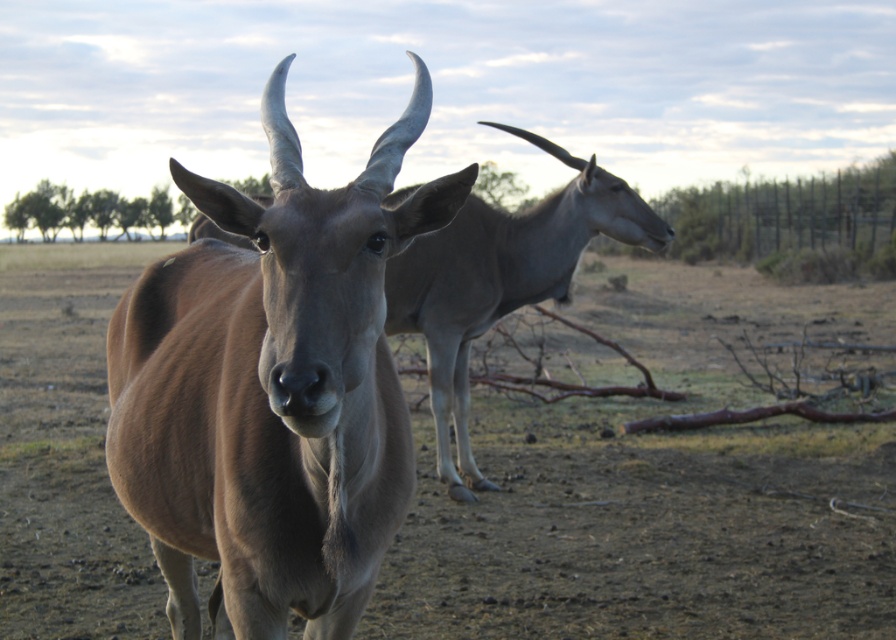
Between point (164, 449) and point (510, 248), which one is positioned in front?

Point (164, 449) is in front.

What do you see at coordinates (273, 388) in the screenshot? I see `brown smooth antelope at center` at bounding box center [273, 388].

Where is `brown smooth antelope at center`? Image resolution: width=896 pixels, height=640 pixels. brown smooth antelope at center is located at coordinates (273, 388).